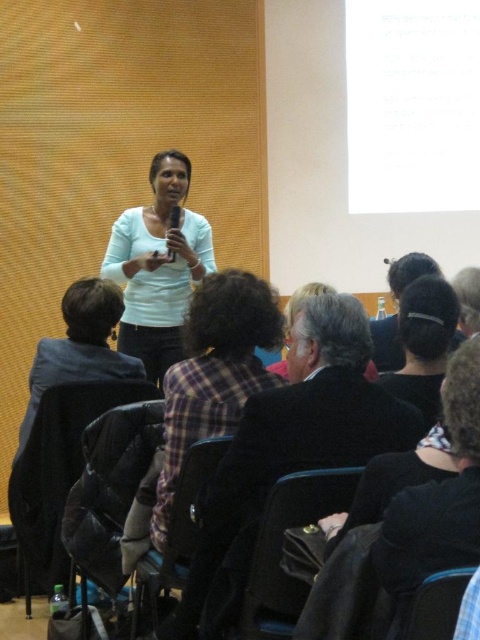
Can you confirm if plaid fabric shirt at center is smaller than dark gray fabric jacket at lower left?

No.

Is plaid fabric shirt at center below dark gray fabric jacket at lower left?

Yes.

The height and width of the screenshot is (640, 480). What do you see at coordinates (214, 372) in the screenshot?
I see `plaid fabric shirt at center` at bounding box center [214, 372].

Locate an element on the screen. plaid fabric shirt at center is located at coordinates (214, 372).

Between point (219, 573) and point (408, 369), which one is positioned in front?

Point (219, 573) is in front.

Can you confirm if dark brown leather jacket at center is positioned above dark hair at center?

Actually, dark brown leather jacket at center is below dark hair at center.

Is point (392, 413) positioned behind point (425, 396)?

No, (392, 413) is closer to viewer.

Locate an element on the screen. dark brown leather jacket at center is located at coordinates (288, 452).

Can you confirm if dark brown leather jacket at center is positioned to the right of plaid fabric shirt at center?

Correct, you'll find dark brown leather jacket at center to the right of plaid fabric shirt at center.

Is dark brown leather jacket at center further to the viewer compared to plaid fabric shirt at center?

No.

Is point (269, 442) positioned in front of point (240, 300)?

Yes, it is.

Locate an element on the screen. The height and width of the screenshot is (640, 480). dark brown leather jacket at center is located at coordinates (288, 452).